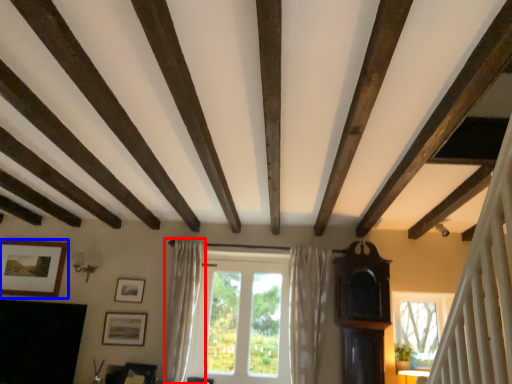
Question: Which point is further to the camera, curtain (highlighted by a red box) or picture frame (highlighted by a blue box)?

Choices:
 (A) curtain
 (B) picture frame

Answer: (B)